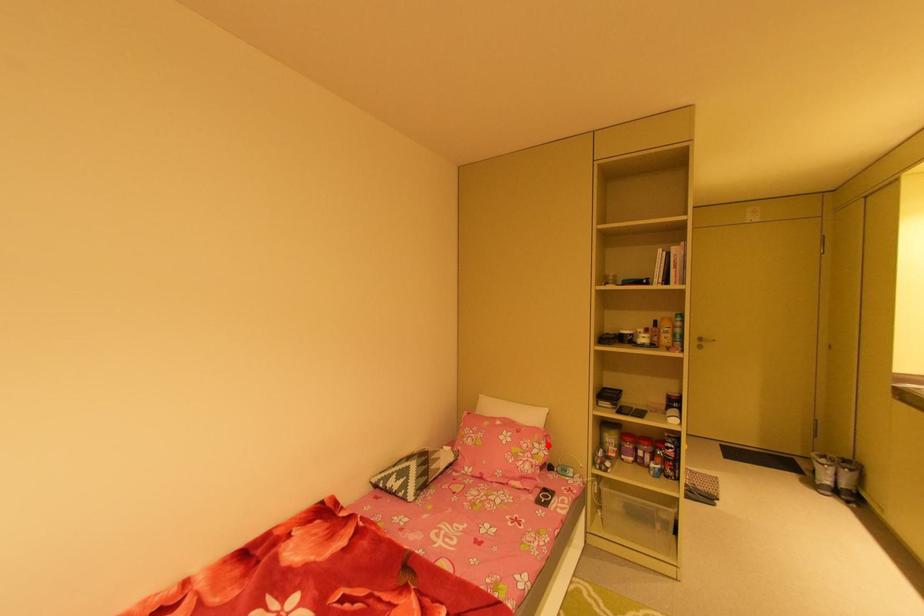
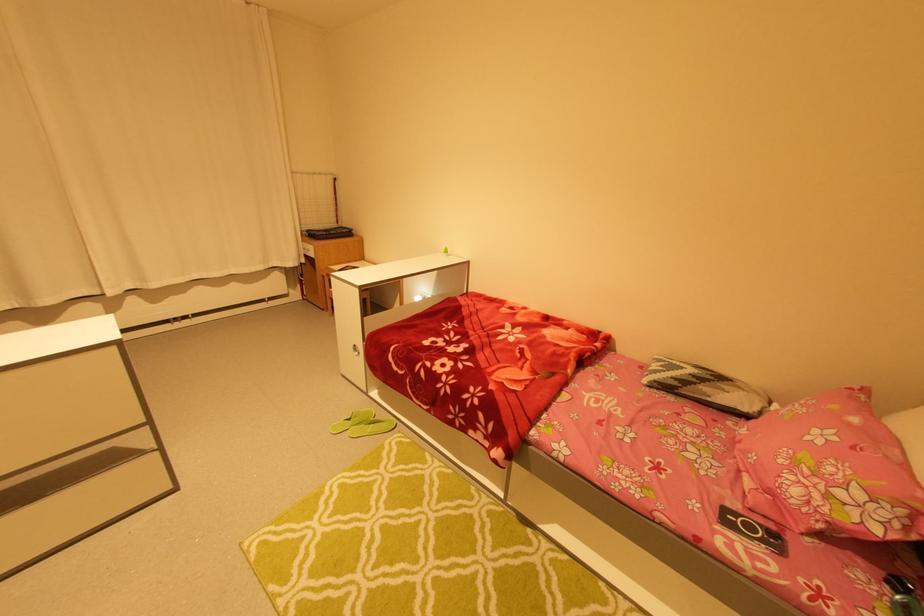
Question: I am providing you with two images of the same scene from different viewpoints. Image1 has a red point marked. In image2, the corresponding 3D location appears at what relative position? Reply with the corresponding letter.

Choices:
 (A) Closer
 (B) Farther

Answer: (B)